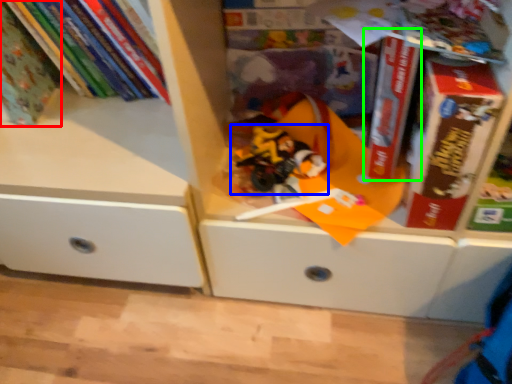
Question: Considering the real-world distances, which object is closest to book (highlighted by a red box)? toy (highlighted by a blue box) or paperback book (highlighted by a green box).

Choices:
 (A) toy
 (B) paperback book

Answer: (A)